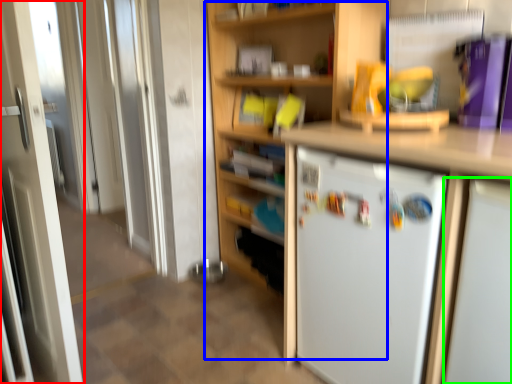
Question: Which object is positioned farthest from door (highlighted by a red box)? Select from bookshelf (highlighted by a blue box) and appliance (highlighted by a green box).

Choices:
 (A) bookshelf
 (B) appliance

Answer: (B)